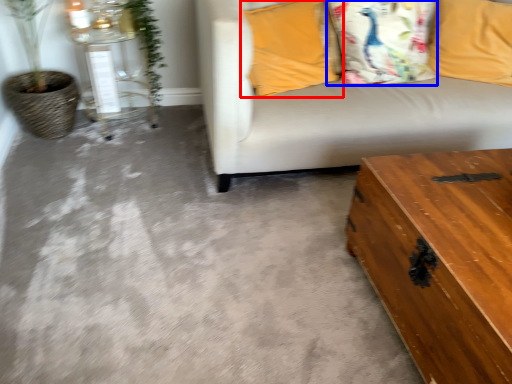
Question: Among these objects, which one is farthest to the camera, pillow (highlighted by a red box) or pillow (highlighted by a blue box)?

Choices:
 (A) pillow
 (B) pillow

Answer: (B)